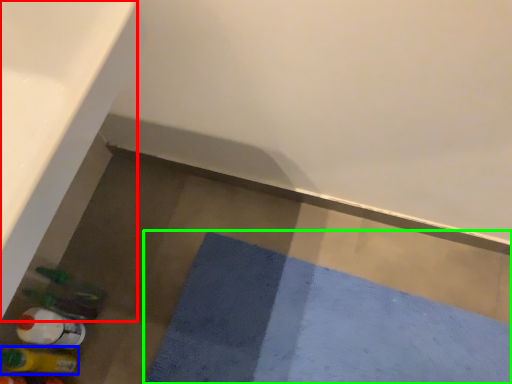
Question: Based on their relative distances, which object is farther from bath (highlighted by a red box)? Choose from bottle (highlighted by a blue box) and bath mat (highlighted by a green box).

Choices:
 (A) bottle
 (B) bath mat

Answer: (B)